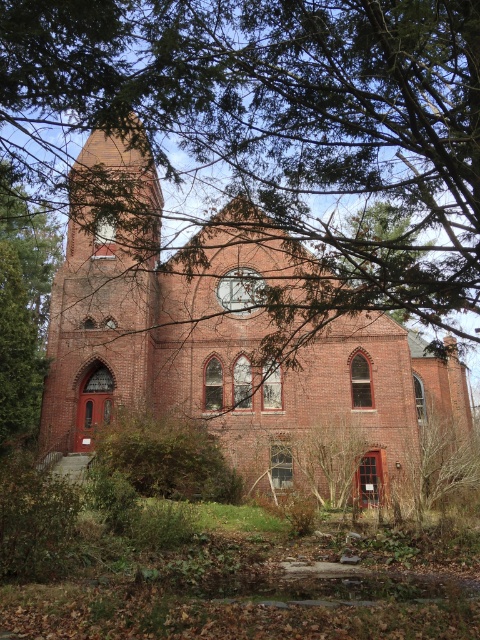
Is green leafy tree at center thinner than brick church at center?

Yes.

Measure the distance between green leafy tree at center and camera.

green leafy tree at center is 32.92 meters away from camera.

Where is `green leafy tree at center`? This screenshot has width=480, height=640. green leafy tree at center is located at coordinates point(283,122).